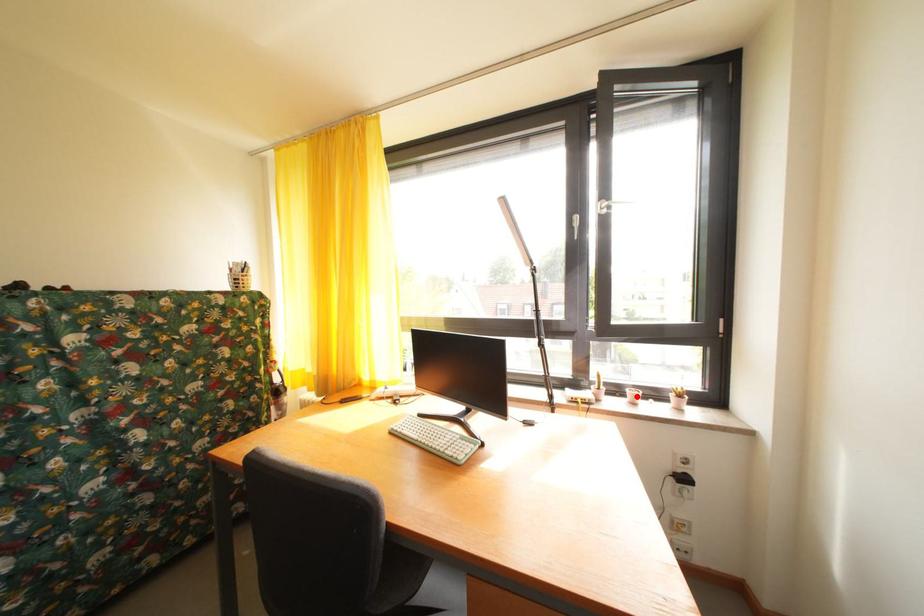
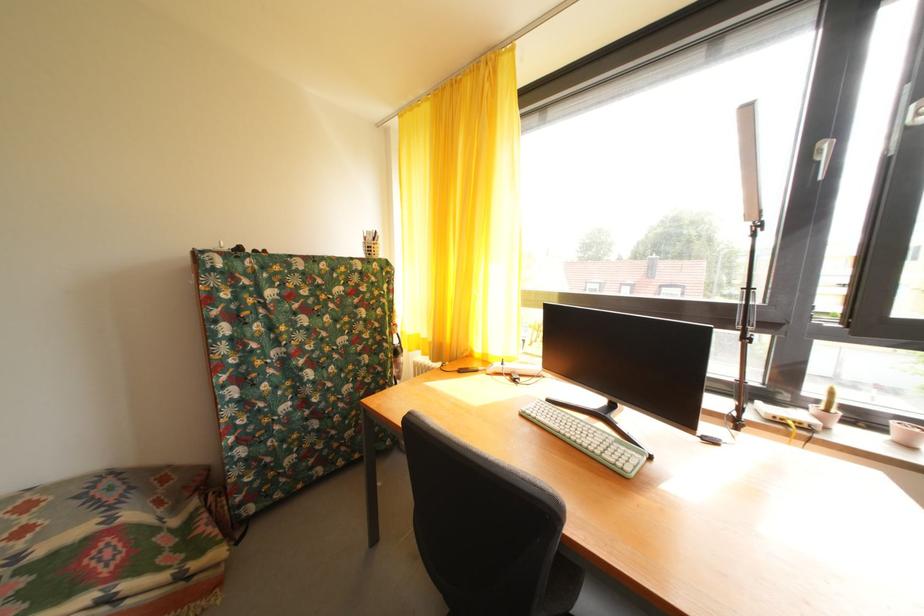
Where in the second image is the point corresponding to the highlighted location from the first image?

(904, 430)